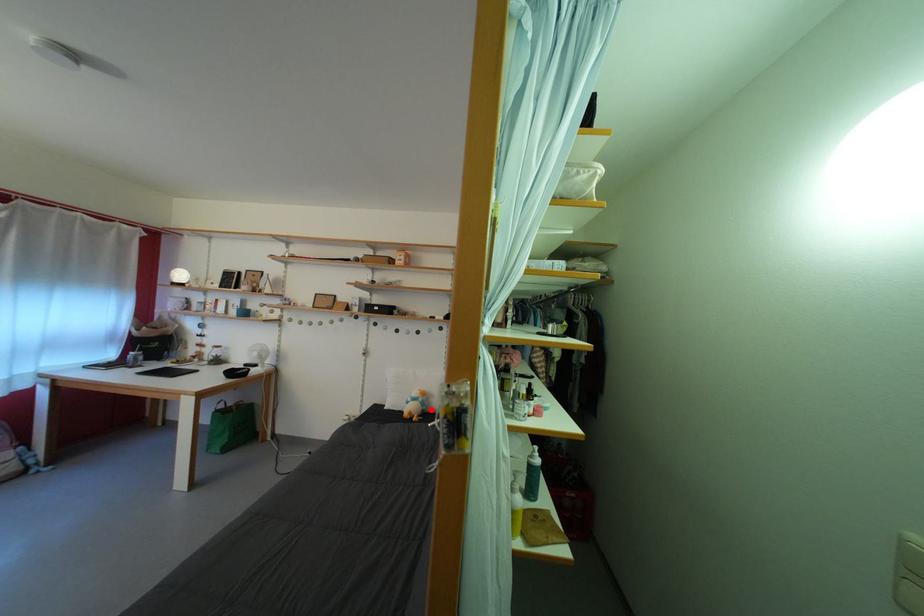
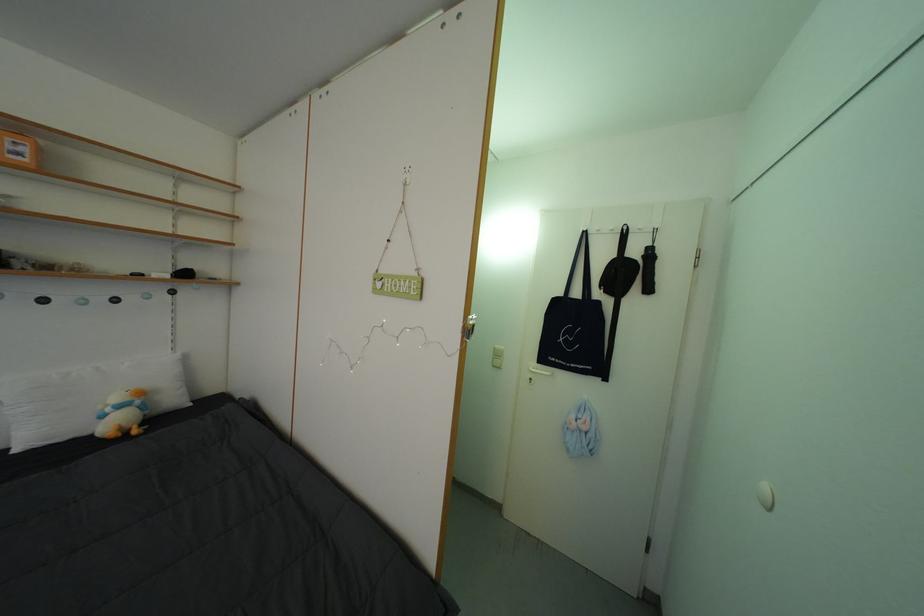
Locate, in the second image, the point that corresponds to the highlighted location in the first image.

(152, 413)